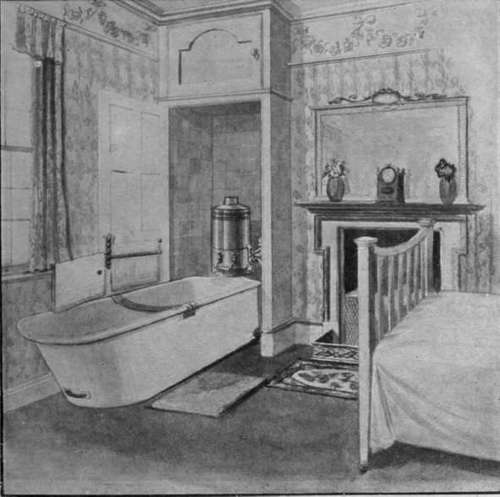
Locate an element on the screen. The height and width of the screenshot is (497, 500). tub is located at coordinates (111, 370).